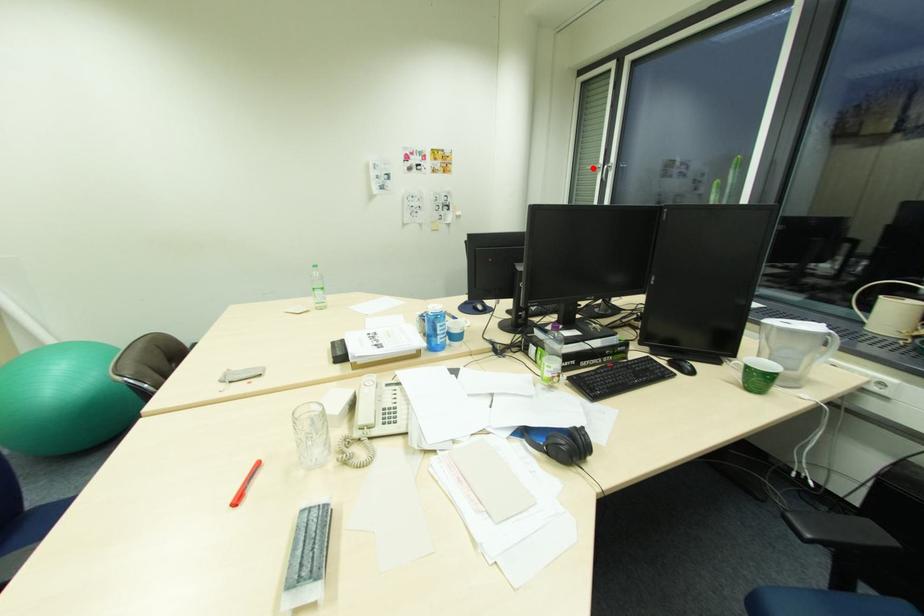
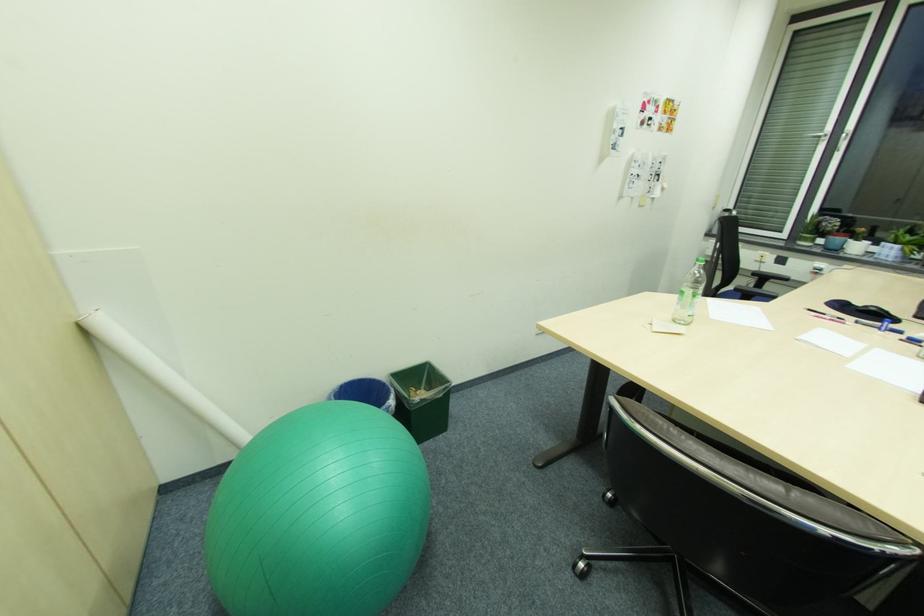
Where in the second image is the point corresponding to the highlighted location from the first image?

(812, 136)